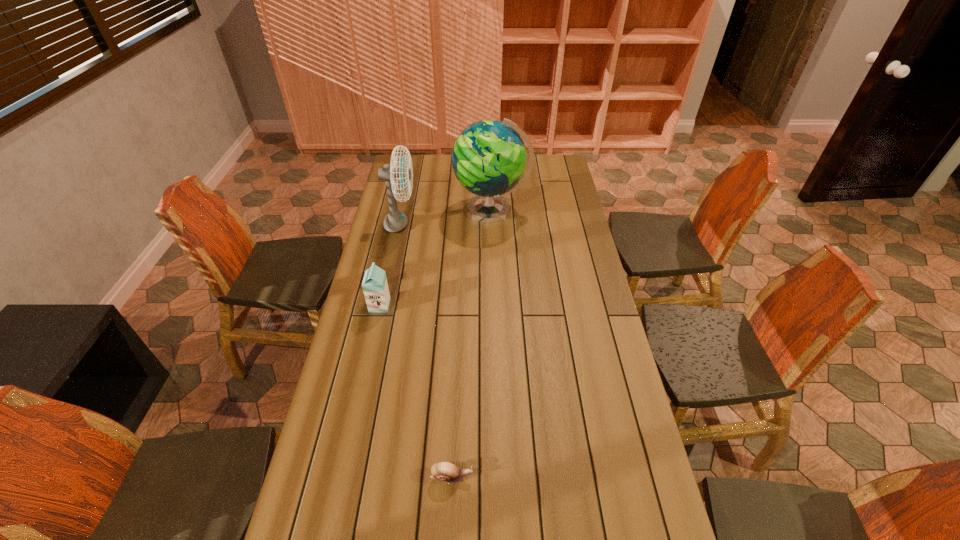
At what (x,y) coordinates should I click in order to perform the action: click on free space between the second shortest object and the escargot. Please return your answer as a coordinate pair (x, y). This screenshot has width=960, height=540. Looking at the image, I should click on (416, 391).

Locate an element on the screen. The image size is (960, 540). free space that is in between the second shortest object and the globe is located at coordinates 436,258.

At what (x,y) coordinates should I click in order to perform the action: click on unoccupied area between the globe and the fan. Please return your answer as a coordinate pair (x, y). The width and height of the screenshot is (960, 540). Looking at the image, I should click on (445, 218).

Find the location of `free space between the third farthest object and the shortest object`. free space between the third farthest object and the shortest object is located at coordinates (416, 391).

The height and width of the screenshot is (540, 960). What are the coordinates of `the closest object to the fan` in the screenshot? It's located at (489, 158).

The width and height of the screenshot is (960, 540). I want to click on object that stands as the second closest to the tallest object, so click(x=375, y=287).

The image size is (960, 540). Identify the location of vacant space that satisfies the following two spatial constraints: 1. on the front surface of the globe; 2. on the front side of the milk carton. (494, 305).